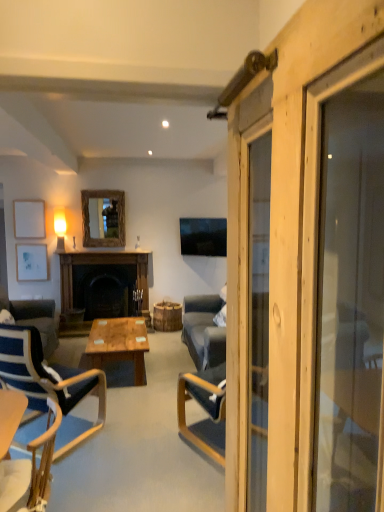
Question: Is white matte picture frame at left, positioned as the second picture frame in top-to-bottom order, positioned in front of blue fabric chair at left, which appears as the second chair when viewed from the front?

Choices:
 (A) yes
 (B) no

Answer: (B)

Question: Is white matte picture frame at left, the 1th picture frame ordered from the bottom, located outside blue fabric chair at left, which appears as the second chair when viewed from the front?

Choices:
 (A) yes
 (B) no

Answer: (A)

Question: Does white matte picture frame at left, positioned as the second picture frame in top-to-bottom order, have a lesser width compared to blue fabric chair at left, which appears as the second chair when viewed from the front?

Choices:
 (A) no
 (B) yes

Answer: (B)

Question: Considering the relative sizes of white matte picture frame at left, the 1th picture frame ordered from the bottom, and blue fabric chair at left, which is the 1th chair in back-to-front order, in the image provided, is white matte picture frame at left, the 1th picture frame ordered from the bottom, taller than blue fabric chair at left, which is the 1th chair in back-to-front order,?

Choices:
 (A) no
 (B) yes

Answer: (A)

Question: Can you see white matte picture frame at left, the 1th picture frame ordered from the bottom, touching blue fabric chair at left, which is the 1th chair in back-to-front order?

Choices:
 (A) no
 (B) yes

Answer: (A)

Question: Is wooden polished coffee table at center bigger or smaller than wooden barn door at right?

Choices:
 (A) small
 (B) big

Answer: (B)

Question: From the image's perspective, is wooden polished coffee table at center above or below wooden barn door at right?

Choices:
 (A) above
 (B) below

Answer: (B)

Question: In the image, is wooden polished coffee table at center positioned in front of or behind wooden barn door at right?

Choices:
 (A) behind
 (B) front

Answer: (A)

Question: From their relative heights in the image, would you say wooden polished coffee table at center is taller or shorter than wooden barn door at right?

Choices:
 (A) tall
 (B) short

Answer: (B)

Question: From the image's perspective, is white matte picture frame at left, positioned as the second picture frame in top-to-bottom order, located above or below wooden chair at lower left, the first chair from the front?

Choices:
 (A) above
 (B) below

Answer: (A)

Question: Would you say white matte picture frame at left, positioned as the second picture frame in top-to-bottom order, is inside or outside wooden chair at lower left, the 2th chair from the back?

Choices:
 (A) outside
 (B) inside

Answer: (A)

Question: Is point (31, 264) positioned closer to the camera than point (43, 500)?

Choices:
 (A) closer
 (B) farther

Answer: (B)

Question: In terms of height, does white matte picture frame at left, the 1th picture frame ordered from the bottom, look taller or shorter compared to wooden chair at lower left, the first chair from the front?

Choices:
 (A) short
 (B) tall

Answer: (A)

Question: Considering the positions of point (26, 236) and point (82, 210), is point (26, 236) closer or farther from the camera than point (82, 210)?

Choices:
 (A) closer
 (B) farther

Answer: (A)

Question: In the image, is white matte picture frame at upper left, the 1th picture frame from the top, on the left side or the right side of wooden frame mirror at upper center?

Choices:
 (A) right
 (B) left

Answer: (B)